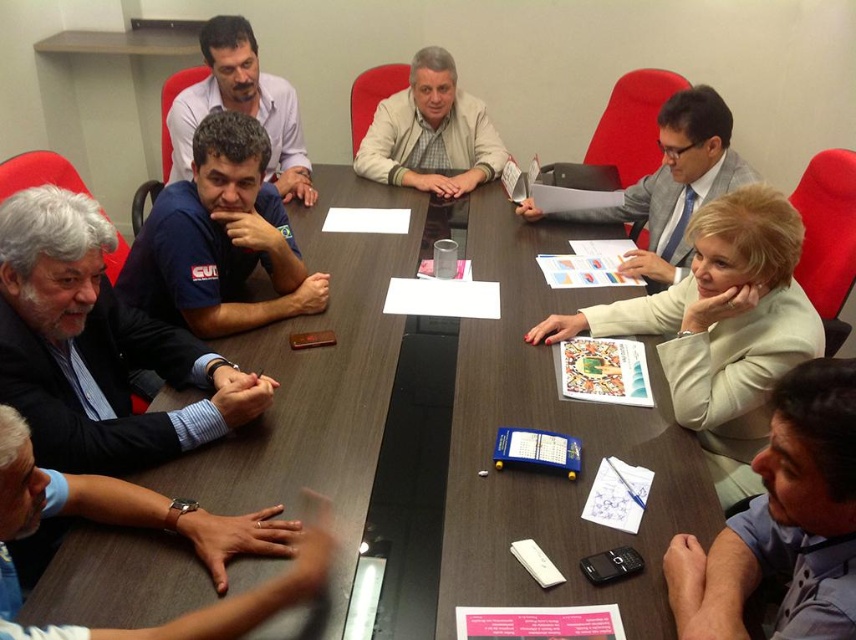
From the picture: You are organizing a photo shoot and need to place a small accessory between the light beige jacket at center and the matte blue shirt at center. Given their sizes, which object should the accessory be placed closer to?

The light beige jacket at center has a smaller size compared to matte blue shirt at center, so the accessory should be placed closer to the light beige jacket at center to balance the visual weight based on their sizes.

You are a photographer standing at the back of the meeting room. You need to capture a photo where both the light beige jacket at center and the matte blue shirt at center are clearly visible. Which clothing item should you focus on first to ensure it appears in focus?

The light beige jacket at center is not as tall as matte blue shirt at center, so you should focus on the matte blue shirt at center first since it is taller and more likely to be in focus.

You are standing at the entrance of the meeting room. You need to locate the gray hair man at left. According to the coordinates provided, where should you look?

The gray hair man at left is located at coordinates point (97, 348).